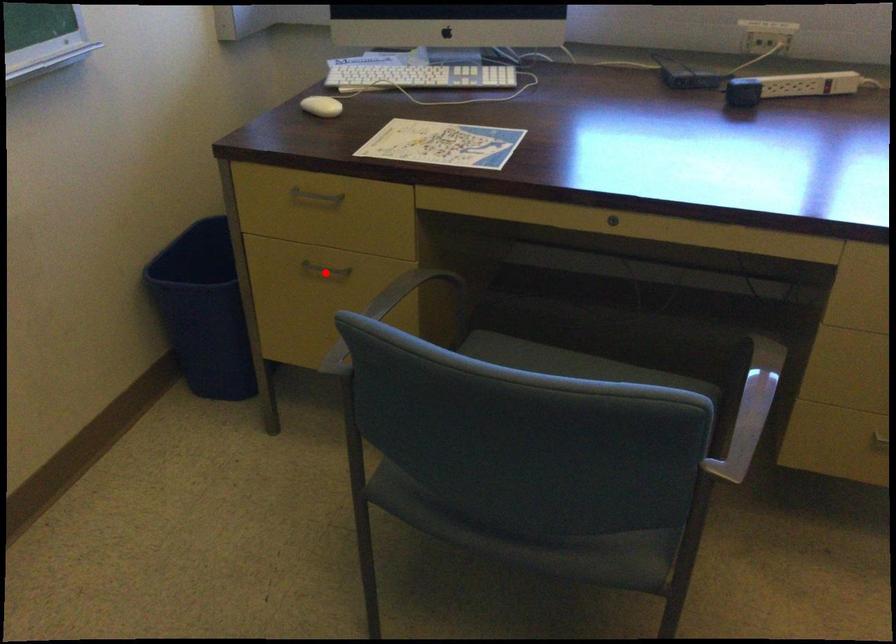
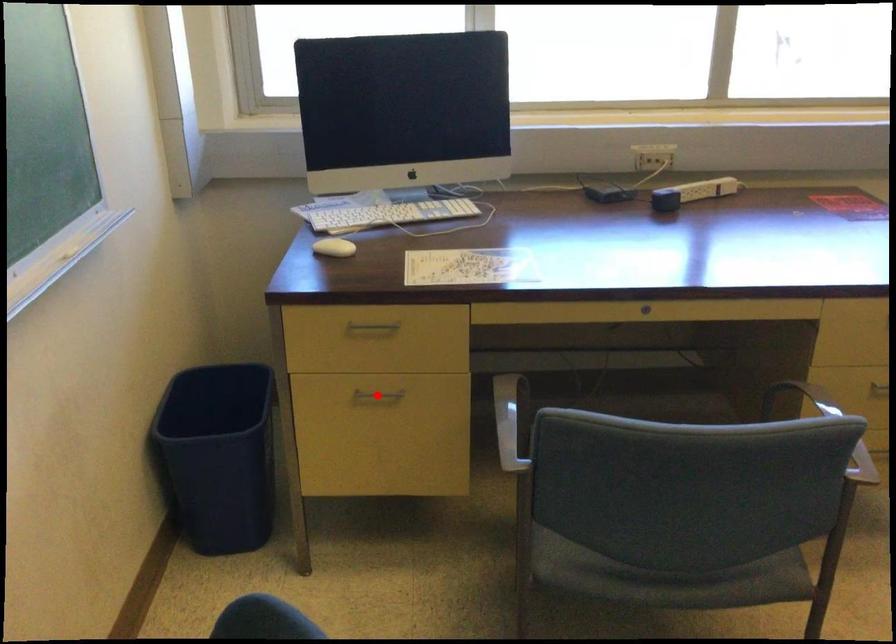
I am providing you with two images of the same scene from different viewpoints. A red point is marked on the first image and another point is marked on the second image. Is the red point in image1 aligned with the point shown in image2?

Yes